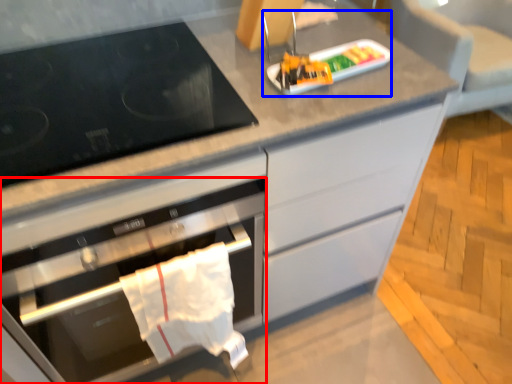
Question: Among these objects, which one is nearest to the camera, oven (highlighted by a red box) or appliance (highlighted by a blue box)?

Choices:
 (A) oven
 (B) appliance

Answer: (A)